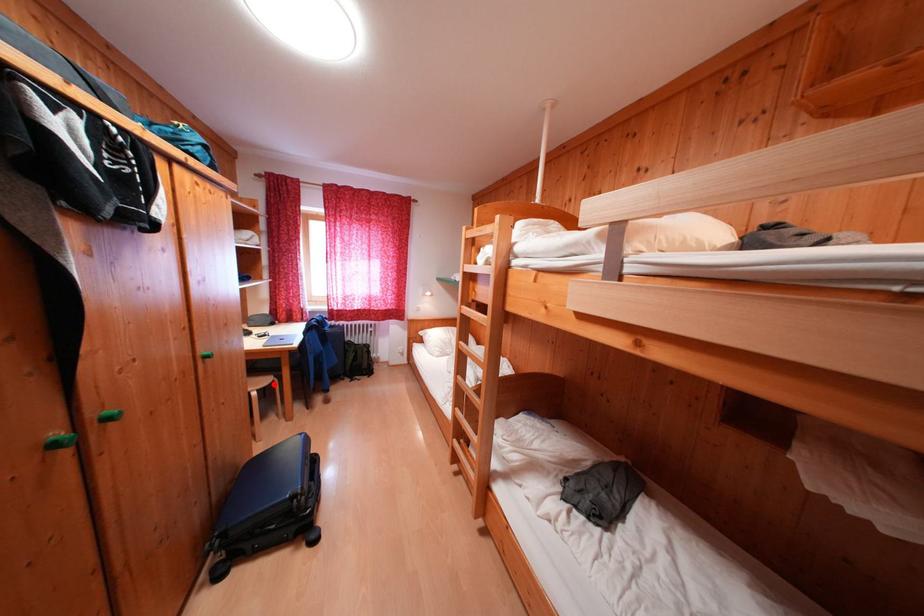
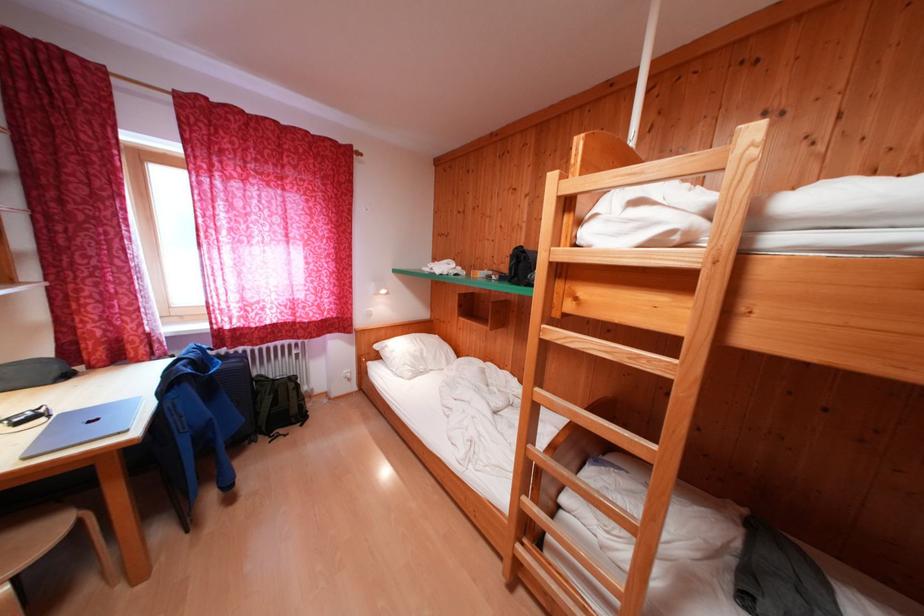
In the second image, find the point that corresponds to the highlighted location in the first image.

(55, 538)